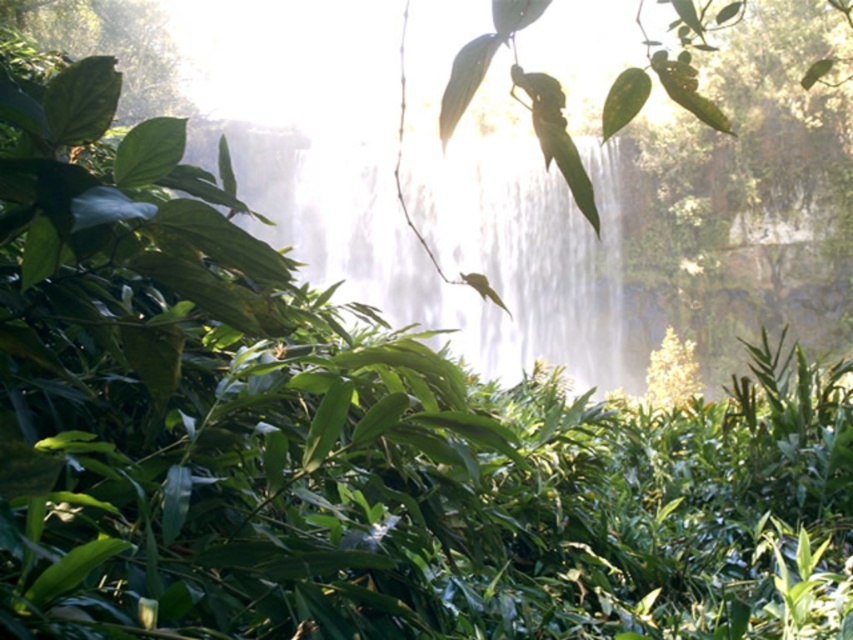
Question: Which point is farther from the camera taking this photo?

Choices:
 (A) (160, 29)
 (B) (367, 285)

Answer: (A)

Question: Is white misty waterfall at center smaller than green leafy plant at upper left?

Choices:
 (A) yes
 (B) no

Answer: (A)

Question: Does white misty waterfall at center have a larger size compared to green leafy plant at upper left?

Choices:
 (A) yes
 (B) no

Answer: (B)

Question: Is white misty waterfall at center in front of green leafy plant at upper left?

Choices:
 (A) yes
 (B) no

Answer: (B)

Question: Which of the following is the closest to the observer?

Choices:
 (A) [x=119, y=19]
 (B) [x=601, y=252]

Answer: (B)

Question: Which object is closer to the camera taking this photo?

Choices:
 (A) green leafy plant at upper left
 (B) white misty waterfall at center

Answer: (A)